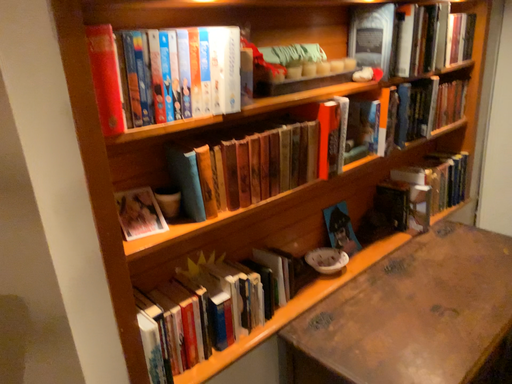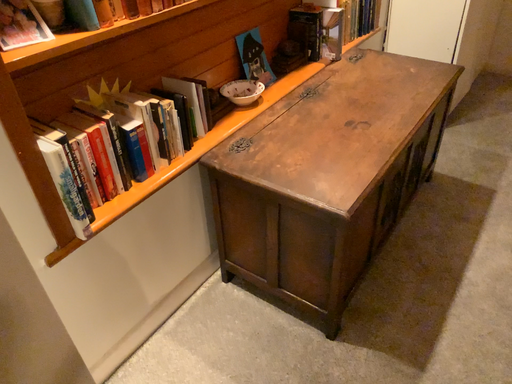
Question: How did the camera likely rotate when shooting the video?

Choices:
 (A) rotated upward
 (B) rotated downward

Answer: (B)